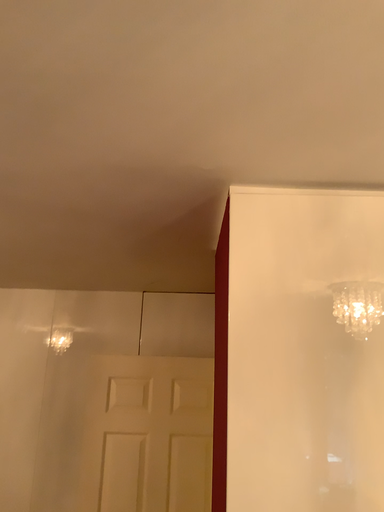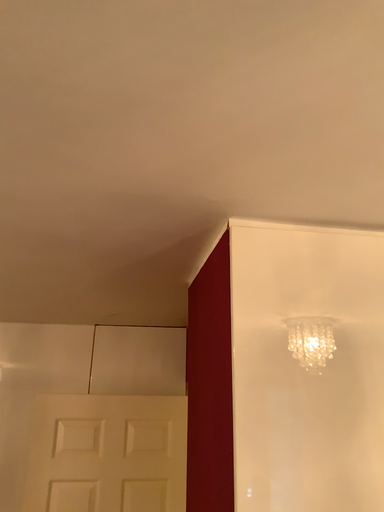
Question: How did the camera likely rotate when shooting the video?

Choices:
 (A) rotated left
 (B) rotated right

Answer: (B)